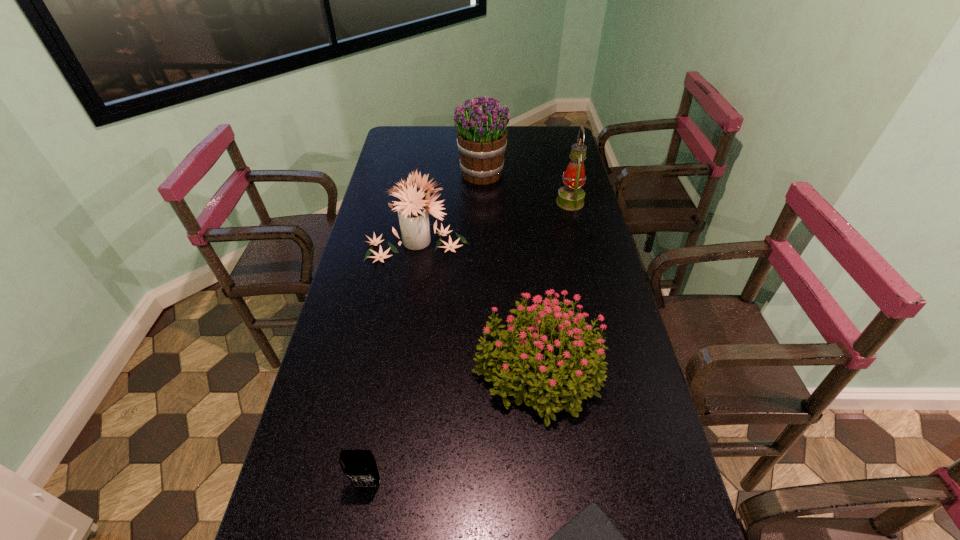
Identify the location of the farthest bouquet. (482, 135).

Identify the location of the tallest bouquet. (482, 135).

At what (x,y) coordinates should I click in order to perform the action: click on the second farthest object. Please return your answer as a coordinate pair (x, y). The image size is (960, 540). Looking at the image, I should click on (571, 197).

At what (x,y) coordinates should I click in order to perform the action: click on the second nearest bouquet. Please return your answer as a coordinate pair (x, y). The width and height of the screenshot is (960, 540). Looking at the image, I should click on (413, 210).

At what (x,y) coordinates should I click in order to perform the action: click on the fourth farthest object. Please return your answer as a coordinate pair (x, y). Looking at the image, I should click on (579, 365).

Locate an element on the screen. The height and width of the screenshot is (540, 960). cellular telephone is located at coordinates (359, 466).

The height and width of the screenshot is (540, 960). I want to click on the second nearest object, so click(x=359, y=466).

This screenshot has width=960, height=540. Identify the location of blank area located 0.370m on the front of the farthest bouquet. (483, 251).

Identify the location of free location located on the front of the second farthest object. The height and width of the screenshot is (540, 960). (575, 222).

At what (x,y) coordinates should I click in order to perform the action: click on free spot located on the front of the second farthest bouquet. Please return your answer as a coordinate pair (x, y). Looking at the image, I should click on (408, 294).